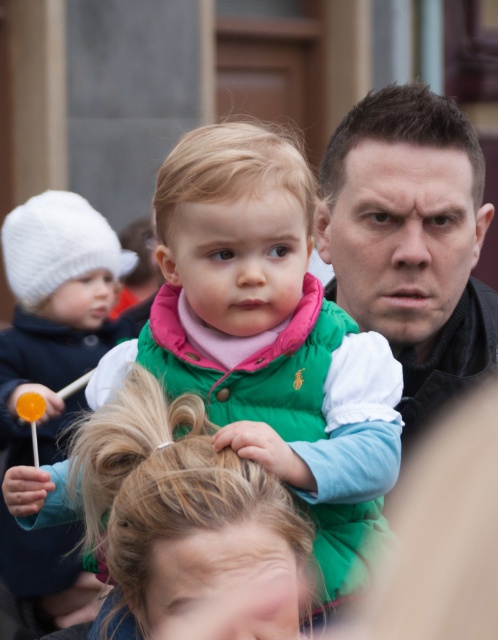
Question: In this image, where is green down jacket at center located relative to matte black jacket at center?

Choices:
 (A) right
 (B) left

Answer: (B)

Question: Is green down jacket at center bigger than matte black jacket at center?

Choices:
 (A) no
 (B) yes

Answer: (A)

Question: Which object is closer to the camera taking this photo?

Choices:
 (A) green down jacket at center
 (B) matte black jacket at center

Answer: (A)

Question: Among these objects, which one is nearest to the camera?

Choices:
 (A) green down jacket at center
 (B) white knitted hat at left

Answer: (A)

Question: Among these points, which one is farthest from the camera?

Choices:
 (A) (216, 145)
 (B) (420, 248)
 (C) (87, 275)

Answer: (C)

Question: Does green down jacket at center have a larger size compared to matte black jacket at center?

Choices:
 (A) yes
 (B) no

Answer: (B)